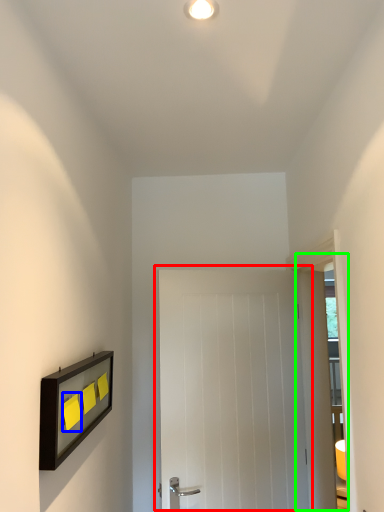
Question: Considering the real-world distances, which object is farthest from door (highlighted by a red box)? light switch (highlighted by a blue box) or glass door (highlighted by a green box)?

Choices:
 (A) light switch
 (B) glass door

Answer: (A)